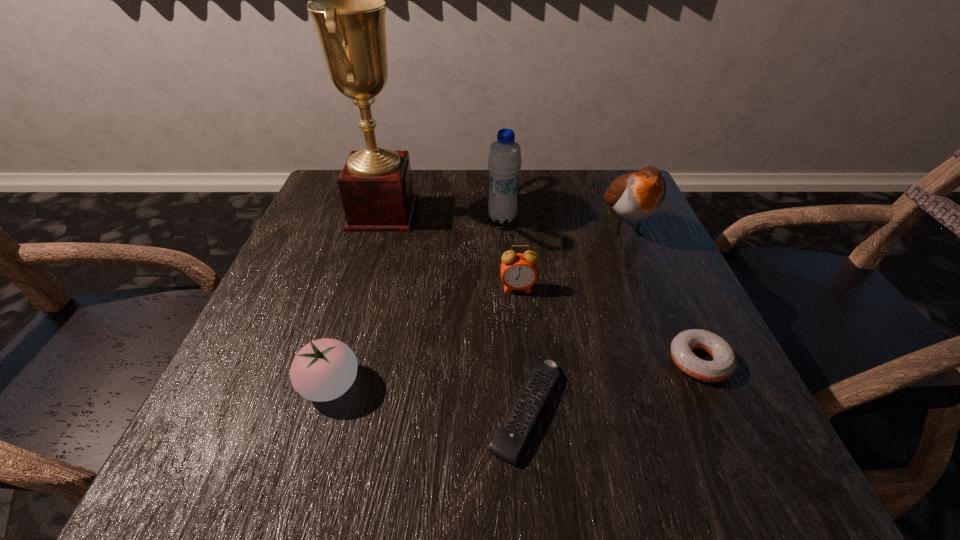
You are a GUI agent. You are given a task and a screenshot of the screen. Output one action in this format:
    pyautogui.click(x=<x>, y=<y>)
    Task: Click on the tallest object
    
    Given the screenshot: What is the action you would take?
    pyautogui.click(x=375, y=184)

At what (x,y) coordinates should I click in order to perform the action: click on the second tallest object. Please return your answer as a coordinate pair (x, y). Image resolution: width=960 pixels, height=540 pixels. Looking at the image, I should click on (504, 162).

Where is `bird`? bird is located at coordinates (636, 196).

The image size is (960, 540). In order to click on alarm clock in this screenshot , I will do tap(518, 271).

Locate an element on the screen. tomato is located at coordinates (324, 369).

Identify the location of doughnut. (724, 362).

Identify the location of the shortest object. Image resolution: width=960 pixels, height=540 pixels. (514, 431).

Identify the location of free space located on the plaque of the trophy cup. This screenshot has width=960, height=540. (470, 213).

Locate an element on the screen. Image resolution: width=960 pixels, height=540 pixels. free space located on the right of the water bottle is located at coordinates (601, 218).

Where is `free location located 0.100m at the face of the fifth shortest object`? The height and width of the screenshot is (540, 960). free location located 0.100m at the face of the fifth shortest object is located at coordinates (652, 288).